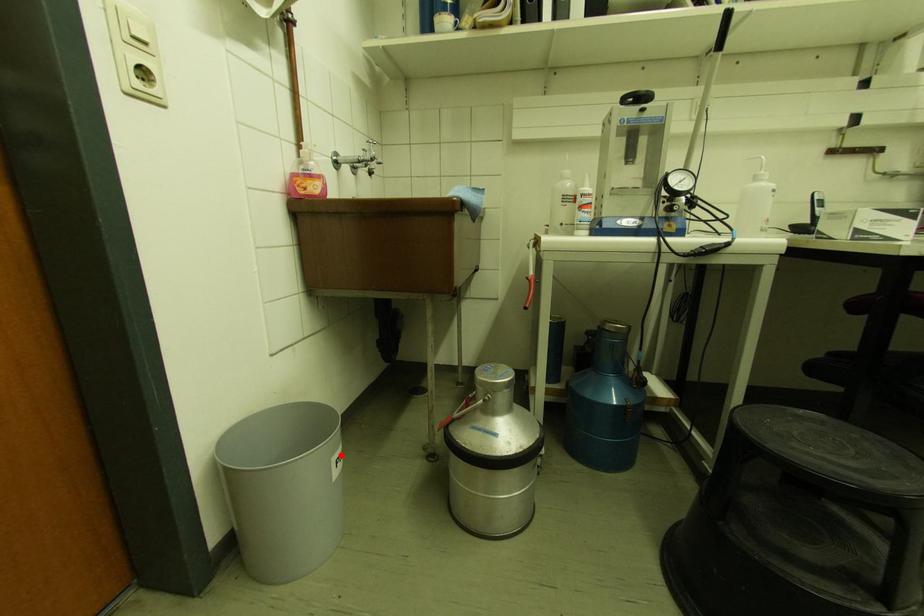
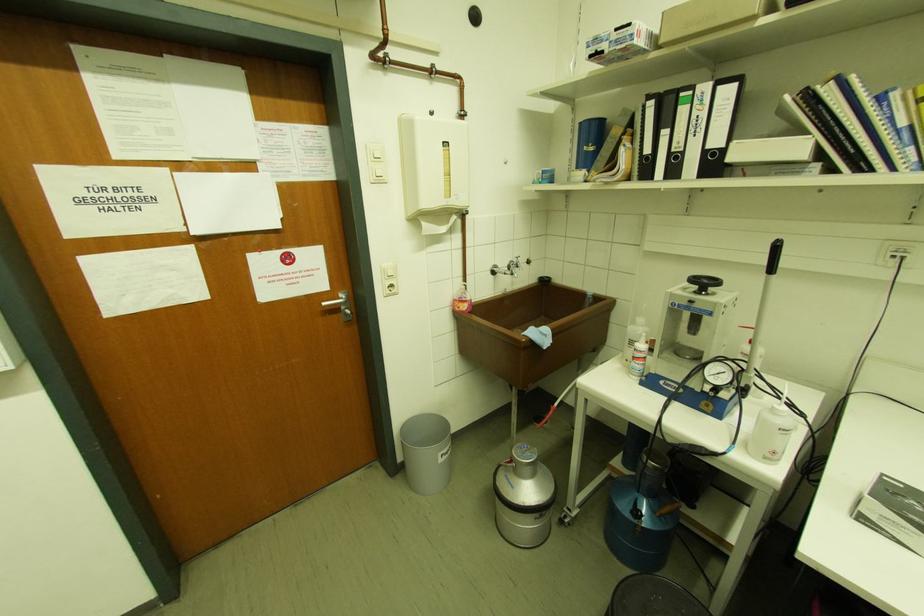
Question: I am providing you with two images of the same scene from different viewpoints. Given a red point in image1, look at the same physical point in image2. Is it:

Choices:
 (A) Closer to the viewpoint
 (B) Farther from the viewpoint

Answer: (A)